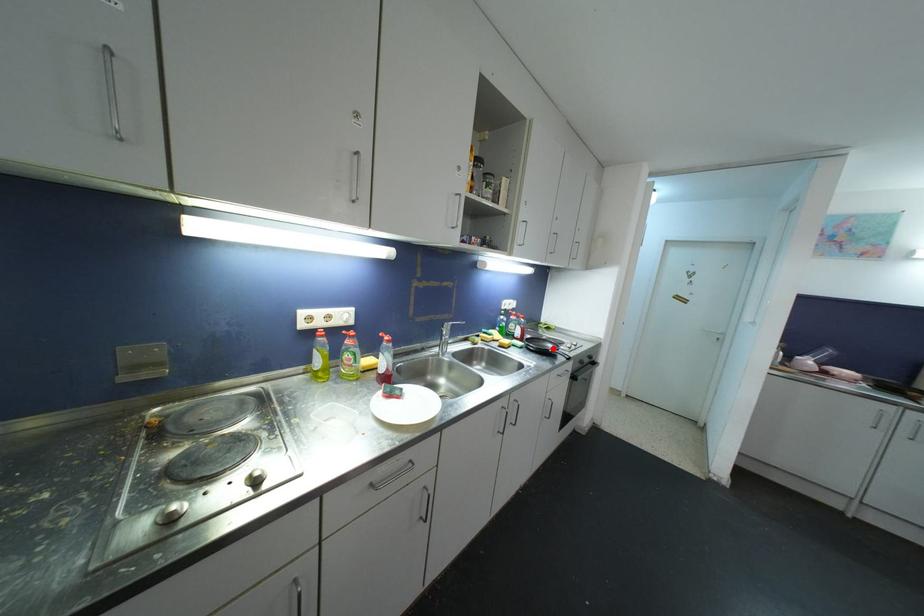
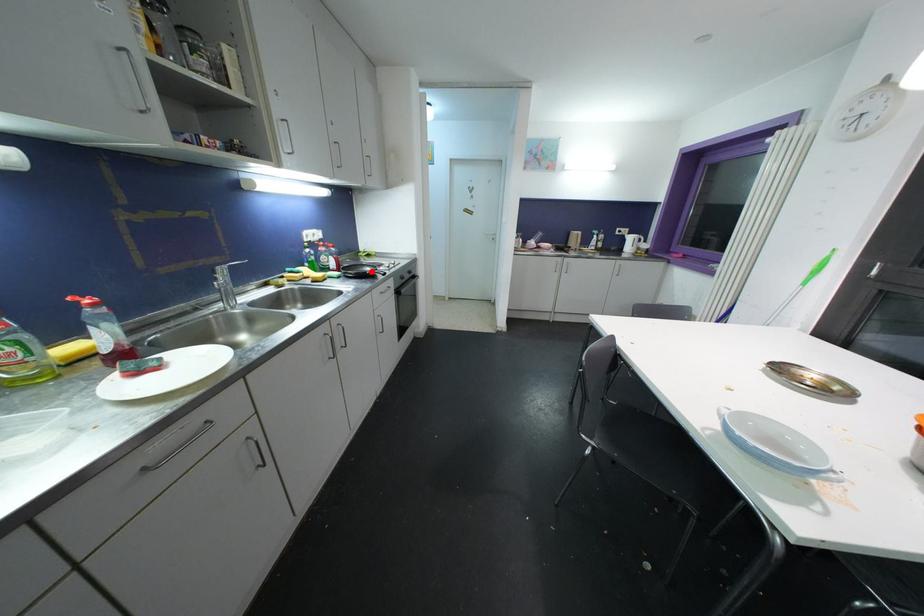
I am providing you with two images of the same scene from different viewpoints. A red point is marked on the first image and another point is marked on the second image. Do the highlighted points in image1 and image2 indicate the same real-world spot?

Yes